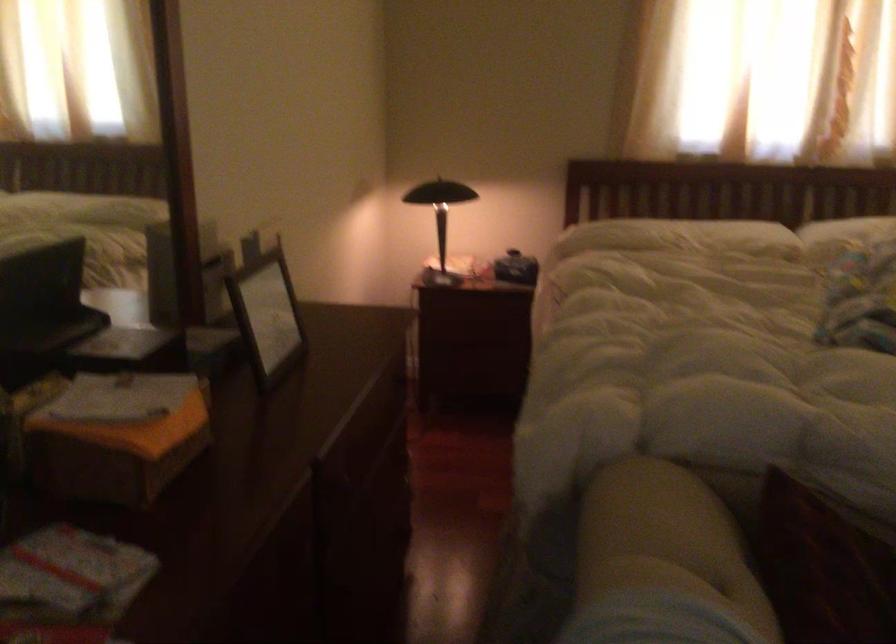
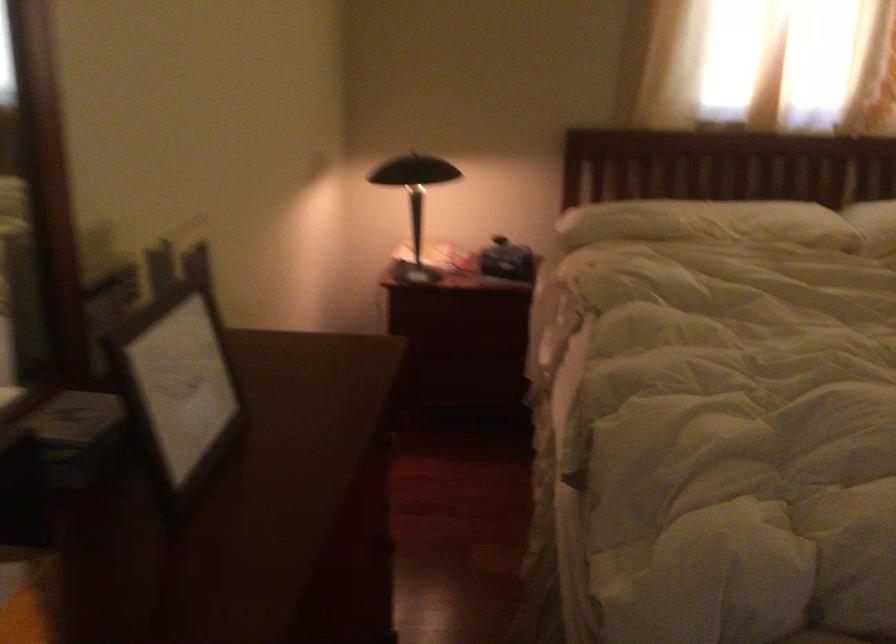
Question: The images are taken continuously from a first-person perspective. In which direction are you moving?

Choices:
 (A) Left
 (B) Right
 (C) Forward
 (D) Backward

Answer: (C)